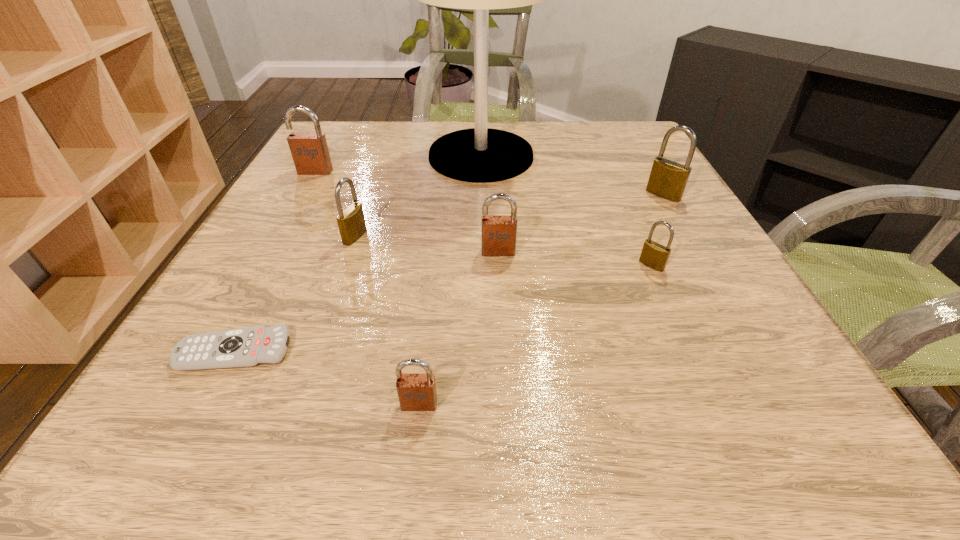
The width and height of the screenshot is (960, 540). In order to click on vacant area between the table lamp and the second nearest object in this screenshot , I will do `click(358, 253)`.

You are a GUI agent. You are given a task and a screenshot of the screen. Output one action in this format:
    pyautogui.click(x=<x>, y=<y>)
    Task: Click on the fourth closest object to the biggest brown padlock
    
    Given the screenshot: What is the action you would take?
    pyautogui.click(x=251, y=346)

Where is `object that is the third closest to the fifth farthest padlock`? The width and height of the screenshot is (960, 540). object that is the third closest to the fifth farthest padlock is located at coordinates (479, 155).

Where is `padlock that can be found as the fourth closest to the fifth farthest object`? padlock that can be found as the fourth closest to the fifth farthest object is located at coordinates (668, 179).

Identify which padlock is located as the fourth nearest to the nearest object. Please provide its 2D coordinates. Your answer should be formatted as a tuple, i.e. [(x, y)], where the tuple contains the x and y coordinates of a point satisfying the conditions above.

[(668, 179)]

Identify which brass padlock is the second closest to the fourth padlock from right to left. Please provide its 2D coordinates. Your answer should be formatted as a tuple, i.e. [(x, y)], where the tuple contains the x and y coordinates of a point satisfying the conditions above.

[(654, 255)]

The width and height of the screenshot is (960, 540). In order to click on the closest brass padlock to the second nearest object in this screenshot , I will do `click(351, 222)`.

Select which brown padlock is the third closest to the third nearest object. Please provide its 2D coordinates. Your answer should be formatted as a tuple, i.e. [(x, y)], where the tuple contains the x and y coordinates of a point satisfying the conditions above.

[(309, 150)]

Identify which brown padlock is located as the nearest to the farthest padlock. Please provide its 2D coordinates. Your answer should be formatted as a tuple, i.e. [(x, y)], where the tuple contains the x and y coordinates of a point satisfying the conditions above.

[(499, 233)]

Identify the location of vacant space that satisfies the following two spatial constraints: 1. on the front-facing side of the biggest brown padlock; 2. on the right side of the second nearest brass padlock. This screenshot has height=540, width=960. (278, 237).